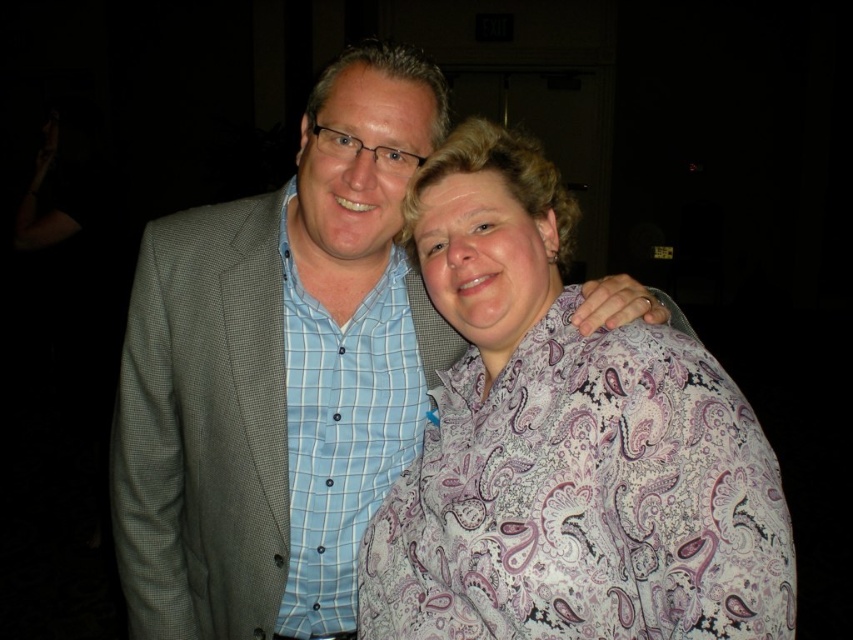
Can you confirm if paisley-patterned blouse at center is smaller than light blue checkered shirt at center?

No.

Who is positioned more to the right, paisley-patterned blouse at center or light blue checkered shirt at center?

paisley-patterned blouse at center

Identify the location of paisley-patterned blouse at center. This screenshot has width=853, height=640. (566, 445).

You are a GUI agent. You are given a task and a screenshot of the screen. Output one action in this format:
    pyautogui.click(x=<x>, y=<y>)
    Task: Click on the paisley-patterned blouse at center
    
    Given the screenshot: What is the action you would take?
    pyautogui.click(x=566, y=445)

Can you confirm if light gray textured blazer at center is positioned to the right of paisley-patterned blouse at center?

No, light gray textured blazer at center is not to the right of paisley-patterned blouse at center.

Is light gray textured blazer at center positioned at the back of paisley-patterned blouse at center?

Yes, it is behind paisley-patterned blouse at center.

You are a GUI agent. You are given a task and a screenshot of the screen. Output one action in this format:
    pyautogui.click(x=<x>, y=<y>)
    Task: Click on the light gray textured blazer at center
    The width and height of the screenshot is (853, 640).
    Given the screenshot: What is the action you would take?
    pyautogui.click(x=277, y=372)

The image size is (853, 640). I want to click on light gray textured blazer at center, so click(277, 372).

In the scene shown: Does light gray textured blazer at center have a lesser width compared to light blue checkered shirt at center?

Incorrect, light gray textured blazer at center's width is not less than light blue checkered shirt at center's.

Who is positioned more to the left, light gray textured blazer at center or light blue checkered shirt at center?

Positioned to the left is light gray textured blazer at center.

Is point (311, 104) closer to camera compared to point (384, 356)?

That is True.

This screenshot has height=640, width=853. In order to click on light gray textured blazer at center in this screenshot , I will do `click(277, 372)`.